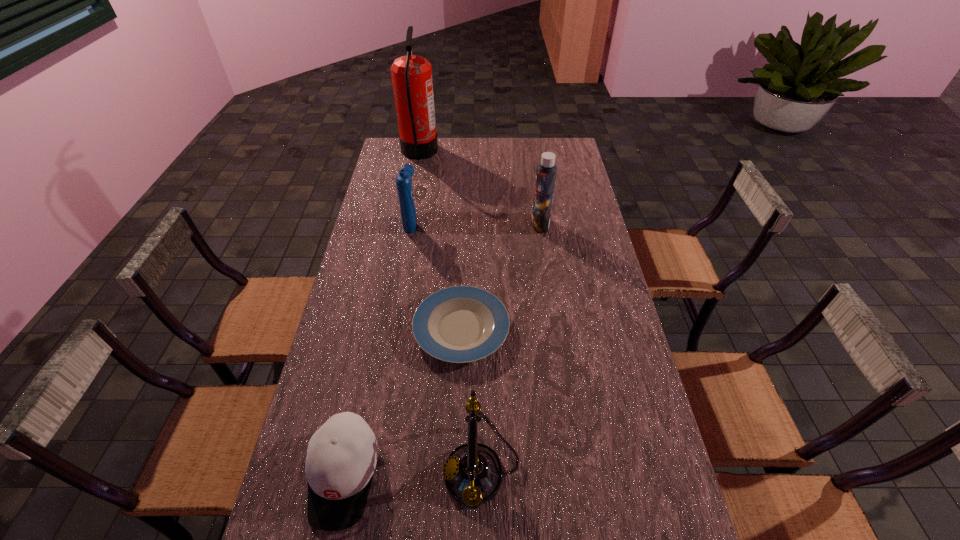
At what (x,y) coordinates should I click in order to perform the action: click on free space that satisfies the following two spatial constraints: 1. on the dial of the telephone; 2. on the front-facing side of the baseball cap. Please return your answer as a coordinate pair (x, y). The width and height of the screenshot is (960, 540). Looking at the image, I should click on (482, 475).

Where is `free space that satisfies the following two spatial constraints: 1. on the front side of the plate; 2. on the left side of the tallest object`? The image size is (960, 540). free space that satisfies the following two spatial constraints: 1. on the front side of the plate; 2. on the left side of the tallest object is located at coordinates (387, 329).

Find the location of `free space that satisfies the following two spatial constraints: 1. on the back side of the fourth farthest object; 2. on the front side of the tallest object`. free space that satisfies the following two spatial constraints: 1. on the back side of the fourth farthest object; 2. on the front side of the tallest object is located at coordinates (468, 152).